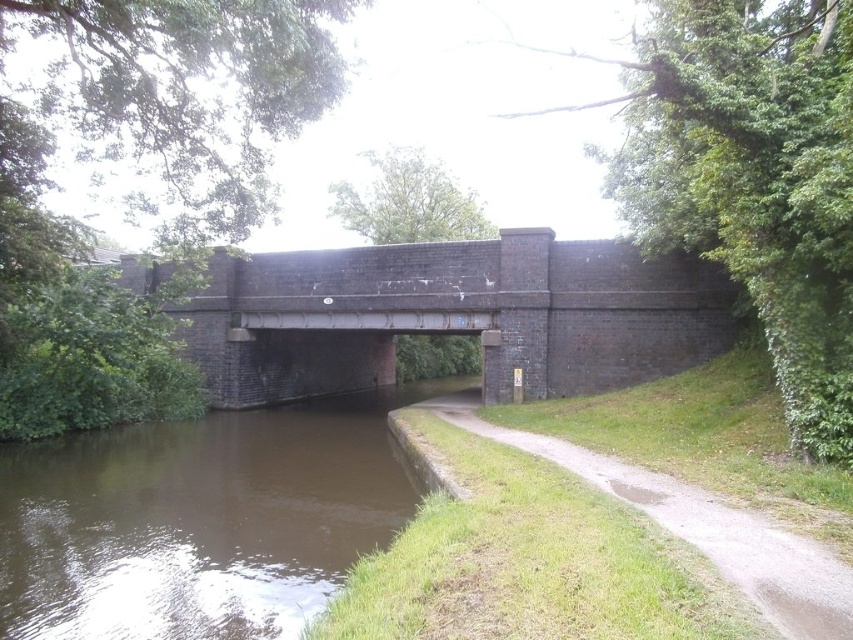
You are standing at the bridge looking towards the canal. There are two points marked in the scene, one at coordinates point (22, 541) and the other at point (850, 595). Which point is closer to you?

Point (22, 541) is closer to you because it is further to the viewer than point (850, 595).

You are a delivery robot with a waterproof rating of 3 meters. You need to cross from the bridge to the grassy area. The route requires moving from the bridge down to the green grassy path at lower center. However, there is brown murky water at lower left in your path. Can you safely navigate around the water to reach the path without getting wet?

The brown murky water at lower left is to the left of the green grassy path at lower center. Since the robot can go around the water by moving to the right side of the path, it can safely reach the green grassy path at lower center without getting wet.

You are a small toy car that is 10 cm tall. You want to drive under the brown brick bridge at center to reach the green grassy path at lower center. Can you fit under the bridge?

The brown brick bridge at center is taller than green grassy path at lower center. Since the bridge is taller, the clearance under it should be sufficient for the toy car which is only 10 cm tall. Therefore, the toy car can fit under the brown brick bridge at center to reach the green grassy path at lower center.